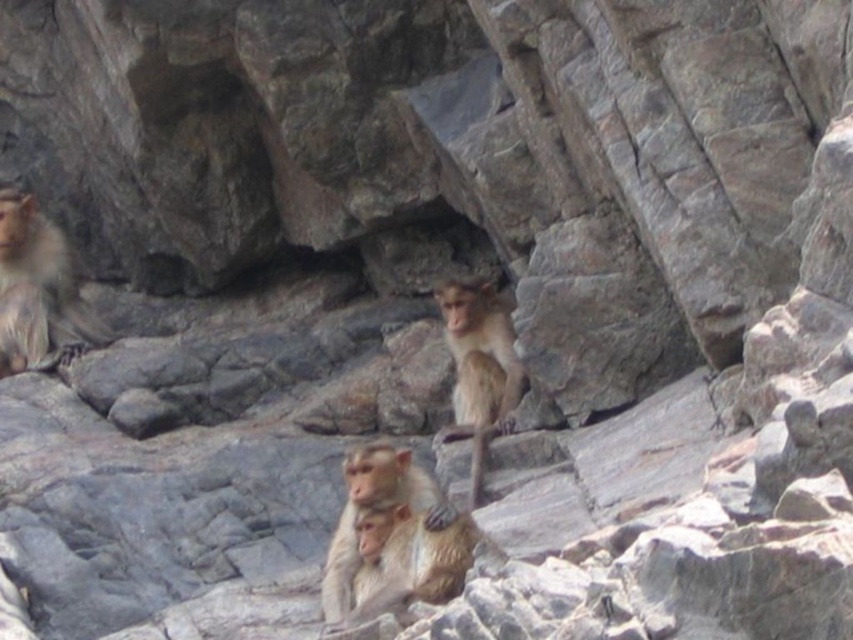
Is golden fur monkey at upper left bigger than brown fur monkey at center?

Yes.

This screenshot has width=853, height=640. What do you see at coordinates (38, 291) in the screenshot?
I see `golden fur monkey at upper left` at bounding box center [38, 291].

The image size is (853, 640). Find the location of `golden fur monkey at upper left`. golden fur monkey at upper left is located at coordinates (38, 291).

Which of these two, brown fur monkey at center or light brown fur monkey at center, stands taller?

Standing taller between the two is brown fur monkey at center.

Measure the distance between point (471, 339) and camera.

Point (471, 339) is 50.50 meters away from camera.

I want to click on brown fur monkey at center, so click(x=479, y=365).

Which of these two, golden fur monkey at center or light brown fur monkey at center, stands taller?

golden fur monkey at center

Does golden fur monkey at center have a lesser height compared to light brown fur monkey at center?

No.

Is point (364, 596) positioned before point (405, 486)?

Yes, it is.

The height and width of the screenshot is (640, 853). Find the location of `golden fur monkey at center`. golden fur monkey at center is located at coordinates click(x=410, y=560).